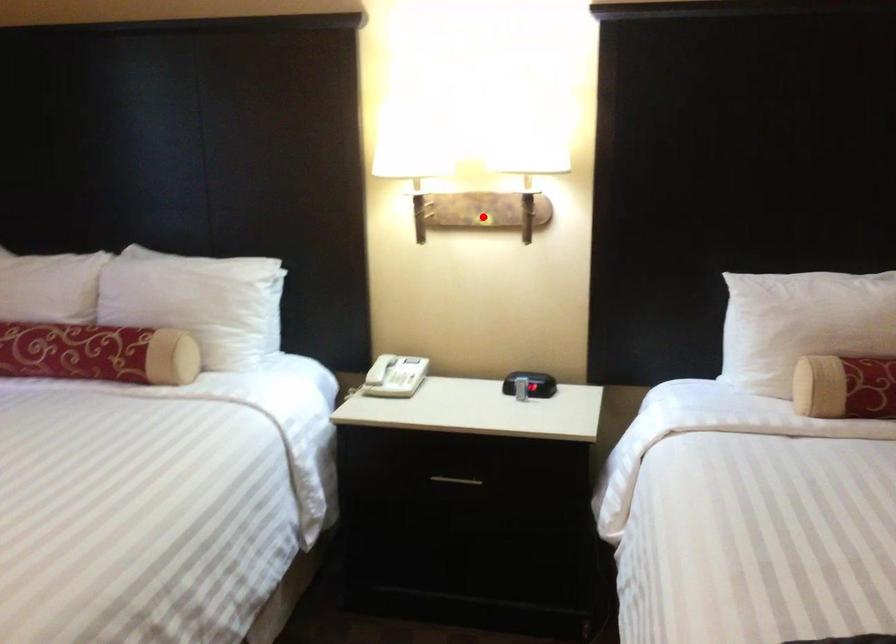
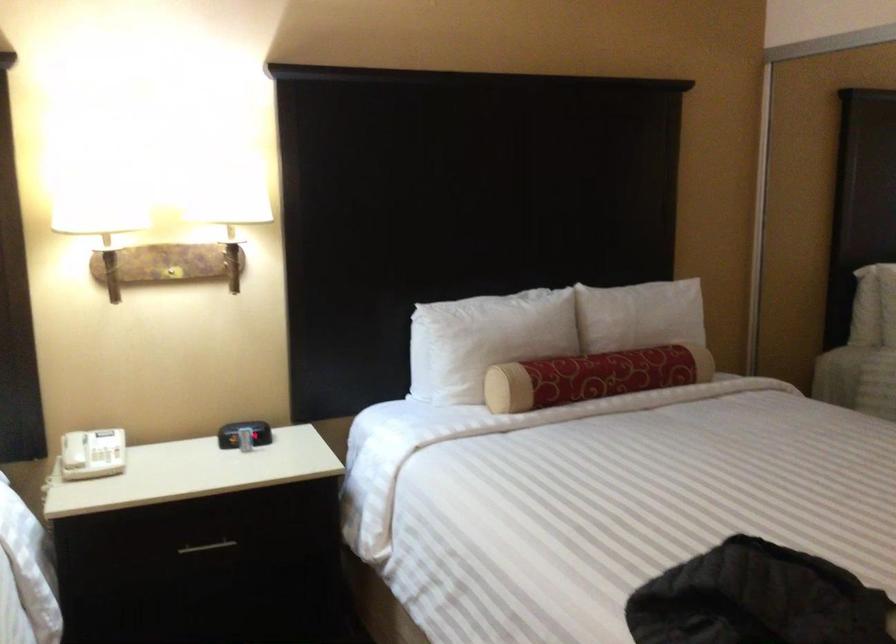
Where in the second image is the point corresponding to the highlighted location from the first image?

(171, 272)